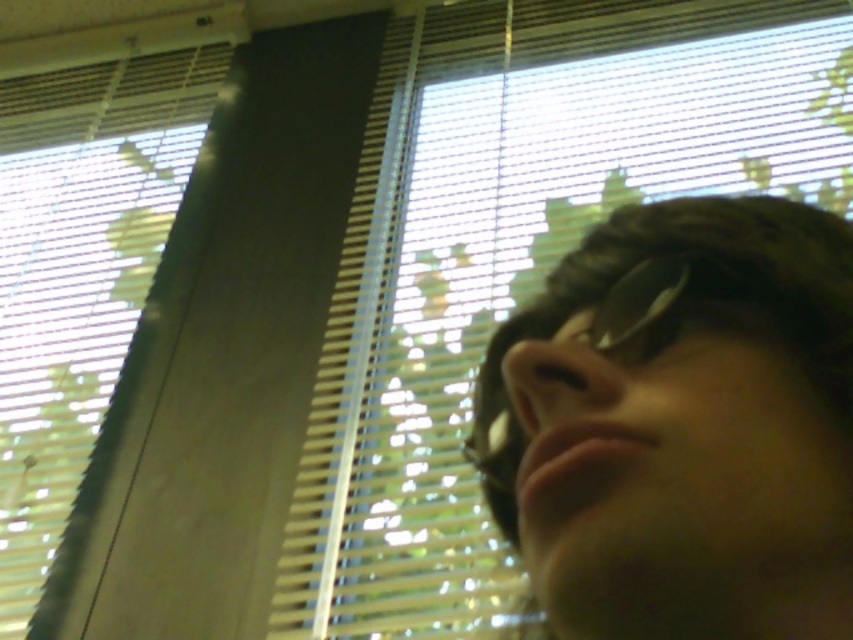
Is white plastic blinds at upper left shorter than sunglasses at center?

No.

Consider the image. How much distance is there between white plastic blinds at upper left and sunglasses at center?

They are 4.46 feet apart.

Locate an element on the screen. white plastic blinds at upper left is located at coordinates (80, 292).

You are a GUI agent. You are given a task and a screenshot of the screen. Output one action in this format:
    pyautogui.click(x=<x>, y=<y>)
    Task: Click on the white plastic blinds at upper left
    This screenshot has height=640, width=853.
    Given the screenshot: What is the action you would take?
    pyautogui.click(x=80, y=292)

Can you confirm if white plastic blinds at upper center is positioned to the left of matte black sunglasses at right?

No, white plastic blinds at upper center is not to the left of matte black sunglasses at right.

Is white plastic blinds at upper center thinner than matte black sunglasses at right?

In fact, white plastic blinds at upper center might be wider than matte black sunglasses at right.

Find the location of a particular element. The width and height of the screenshot is (853, 640). white plastic blinds at upper center is located at coordinates (515, 256).

The image size is (853, 640). I want to click on white plastic blinds at upper center, so click(x=515, y=256).

Is point (670, 376) positioned after point (79, 424)?

No, it is in front of (79, 424).

Does matte black sunglasses at right appear under white plastic blinds at upper left?

Indeed, matte black sunglasses at right is positioned under white plastic blinds at upper left.

What do you see at coordinates (682, 426) in the screenshot?
I see `matte black sunglasses at right` at bounding box center [682, 426].

This screenshot has height=640, width=853. I want to click on matte black sunglasses at right, so (682, 426).